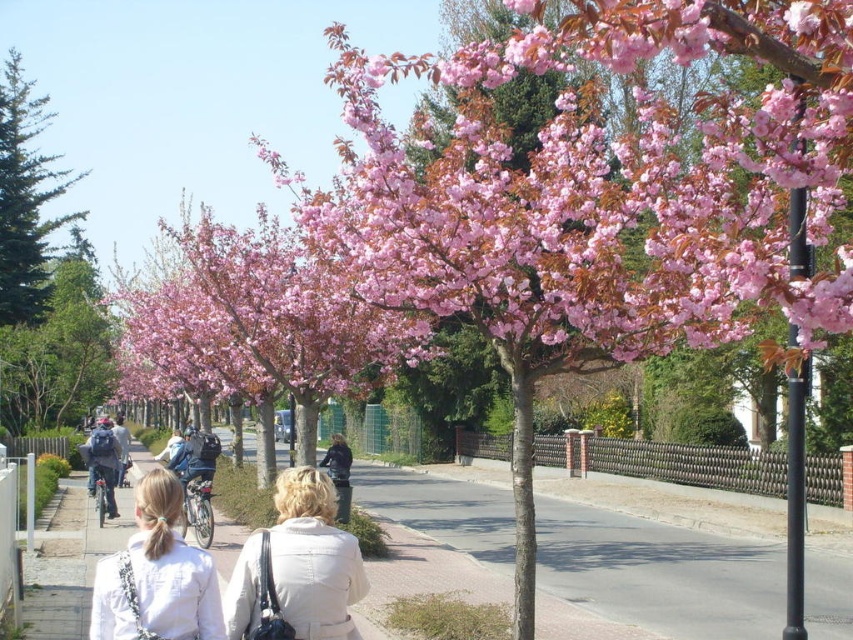
Question: Which point is farther to the camera?

Choices:
 (A) (293, 525)
 (B) (729, 204)
 (C) (132, 609)
 (D) (48, 285)

Answer: (D)

Question: Can you confirm if beige fabric coat at center is positioned above denim jacket at left?

Choices:
 (A) no
 (B) yes

Answer: (B)

Question: Estimate the real-world distances between objects in this image. Which object is closer to the beige fabric coat at center?

Choices:
 (A) denim jacket at left
 (B) pink bloom at center

Answer: (A)

Question: Can you confirm if pink bloom at center is smaller than white fabric jacket at lower center?

Choices:
 (A) yes
 (B) no

Answer: (B)

Question: Is beige fabric coat at center to the left of green evergreen tree at left from the viewer's perspective?

Choices:
 (A) yes
 (B) no

Answer: (B)

Question: Which point appears closest to the camera in this image?

Choices:
 (A) (94, 440)
 (B) (44, 204)
 (C) (341, 552)

Answer: (C)